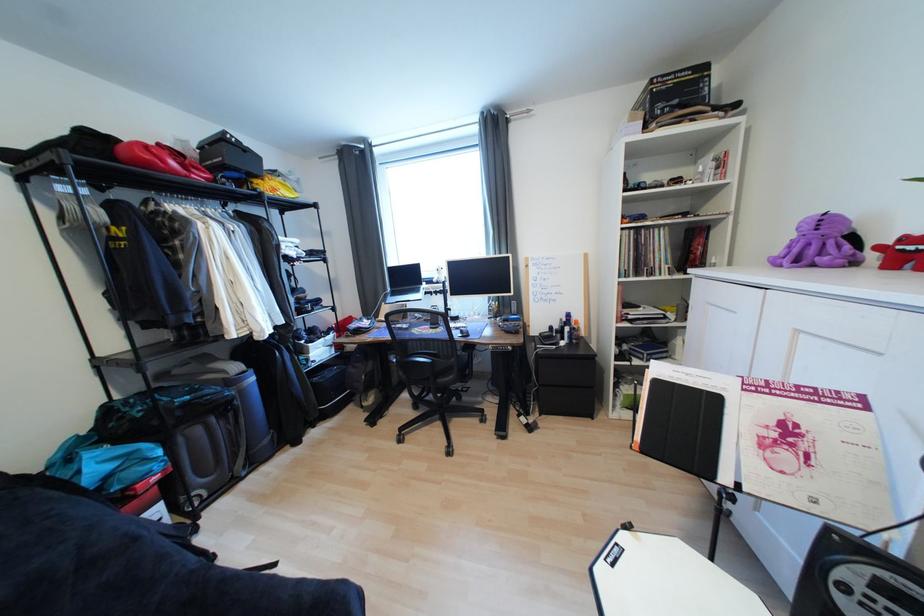
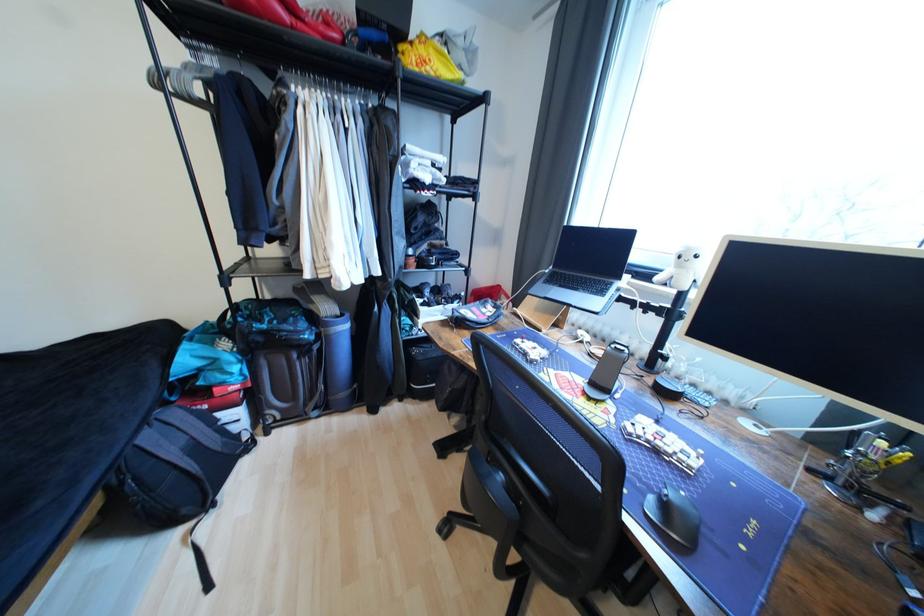
The point at (x=262, y=183) is marked in the first image. Where is the corresponding point in the second image?

(407, 49)